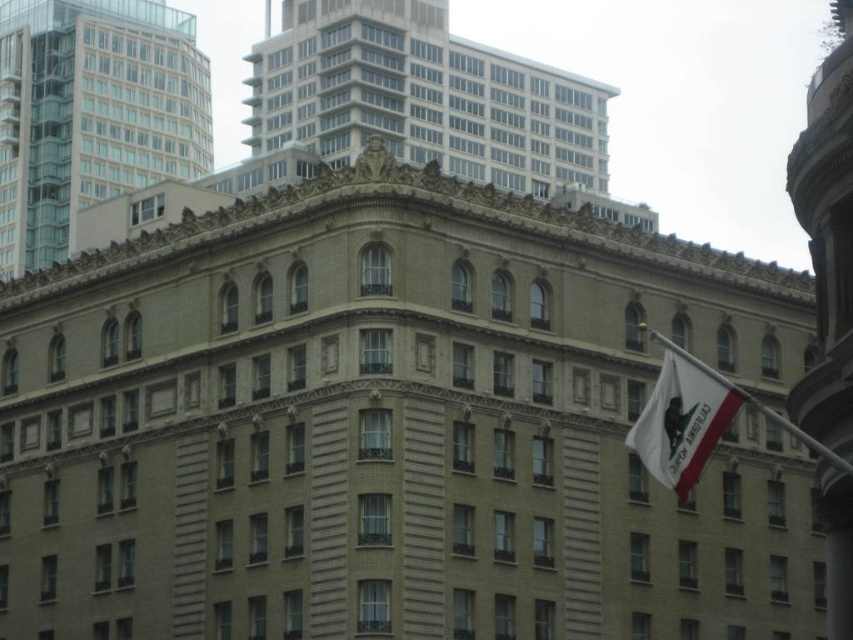
Which is behind, point (173, 164) or point (709, 376)?

Positioned behind is point (173, 164).

Which is below, smooth glass windows at upper left or white fabric flag at right?

white fabric flag at right

Between point (38, 129) and point (714, 429), which one is positioned in front?

Positioned in front is point (714, 429).

Image resolution: width=853 pixels, height=640 pixels. Find the location of `smooth glass windows at upper left`. smooth glass windows at upper left is located at coordinates (91, 113).

Locate an element on the screen. The height and width of the screenshot is (640, 853). smooth concrete building at upper center is located at coordinates (422, 97).

Does point (363, 116) come in front of point (142, 115)?

Yes, it is in front of point (142, 115).

Identify the location of smooth concrete building at upper center. (422, 97).

Is smooth concrete building at upper center taller than white fabric flag at right?

Yes.

Between smooth concrete building at upper center and white fabric flag at right, which one is positioned higher?

smooth concrete building at upper center is higher up.

The height and width of the screenshot is (640, 853). I want to click on smooth concrete building at upper center, so tap(422, 97).